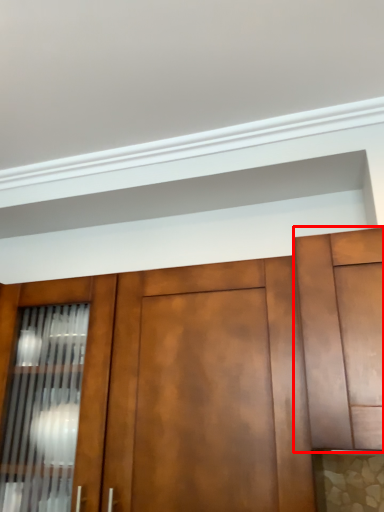
Question: From the image's perspective, considering the relative positions of cabinetry (annotated by the red box) and cabinetry in the image provided, where is cabinetry (annotated by the red box) located with respect to the staircase?

Choices:
 (A) below
 (B) above

Answer: (B)